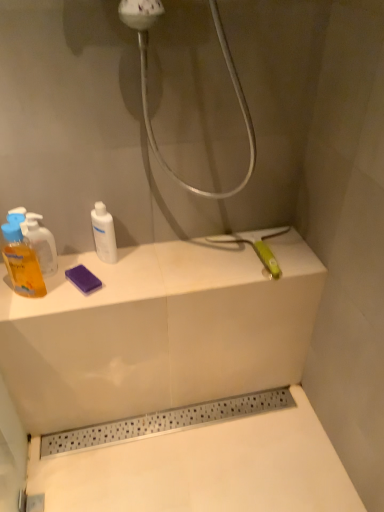
Locate an element on the screen. This screenshot has width=384, height=512. vacant space that is in between translucent orange liquid at left, acting as the second mouthwash starting from the left, and white glossy bottle at center, which is counted as the 3th mouthwash, starting from the left is located at coordinates (79, 266).